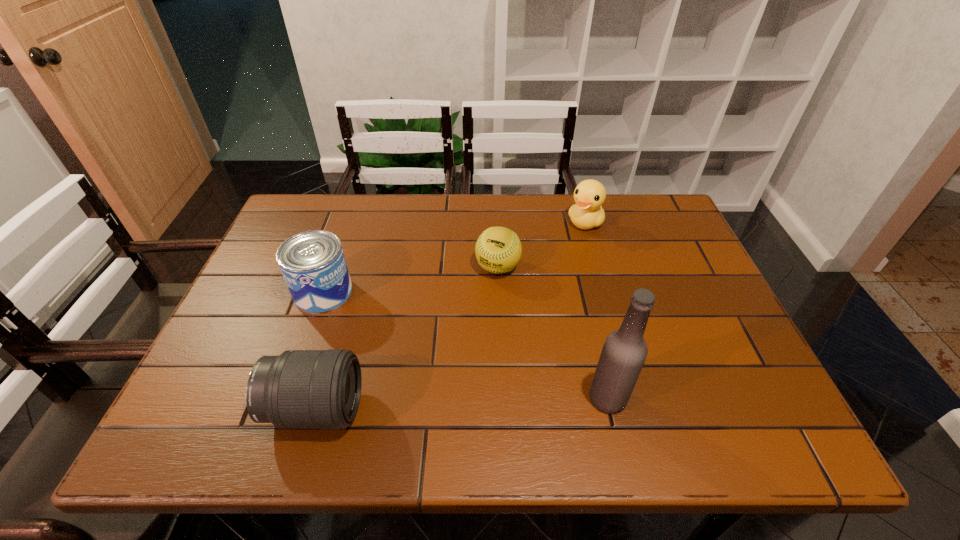
This screenshot has width=960, height=540. Identify the location of vacant space at the far edge of the desktop. (404, 213).

Identify the location of free space at the near edge of the desktop. This screenshot has width=960, height=540. (369, 386).

Locate an element on the screen. The image size is (960, 540). free space at the left edge of the desktop is located at coordinates (266, 261).

Image resolution: width=960 pixels, height=540 pixels. In the image, there is a desktop. Identify the location of free region at the right edge. (716, 363).

Identify the location of vacant space at the far left corner of the desktop. (303, 210).

Find the location of a particular element. free space at the near left corner of the desktop is located at coordinates (245, 375).

You are a GUI agent. You are given a task and a screenshot of the screen. Output one action in this format:
    pyautogui.click(x=<x>, y=<y>)
    Task: Click on the vacant area at the far right corner of the desktop
    The width and height of the screenshot is (960, 540).
    Given the screenshot: What is the action you would take?
    pyautogui.click(x=639, y=224)

Where is `vacant region between the third object from right to left and the can`? The width and height of the screenshot is (960, 540). vacant region between the third object from right to left and the can is located at coordinates (411, 280).

This screenshot has height=540, width=960. I want to click on free spot between the can and the farthest object, so click(454, 257).

Identify the location of unoccupied position between the can and the softball. (411, 280).